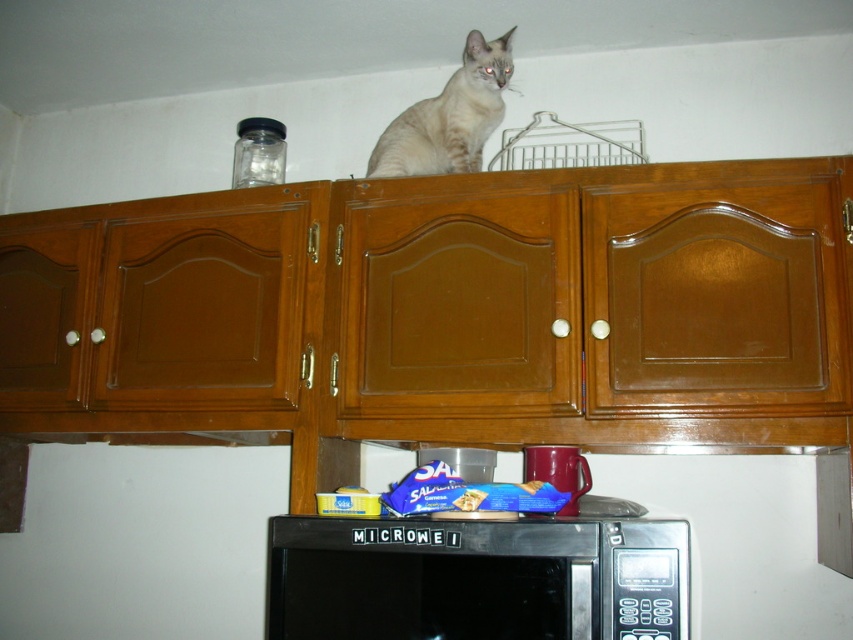
Question: Among these objects, which one is farthest from the camera?

Choices:
 (A) glossy ceramic mug at upper center
 (B) wooden at upper center

Answer: (A)

Question: Can you confirm if black matte microwave at lower center is positioned to the right of glossy ceramic mug at upper center?

Choices:
 (A) no
 (B) yes

Answer: (A)

Question: Is black matte microwave at lower center below light brown fur cat at upper center?

Choices:
 (A) no
 (B) yes

Answer: (B)

Question: Is black matte microwave at lower center wider than light brown fur cat at upper center?

Choices:
 (A) yes
 (B) no

Answer: (A)

Question: Which point is closer to the camera?

Choices:
 (A) wooden at upper center
 (B) light brown fur cat at upper center

Answer: (A)

Question: Which point appears farthest from the camera in this image?

Choices:
 (A) 590,614
 (B) 584,468

Answer: (B)